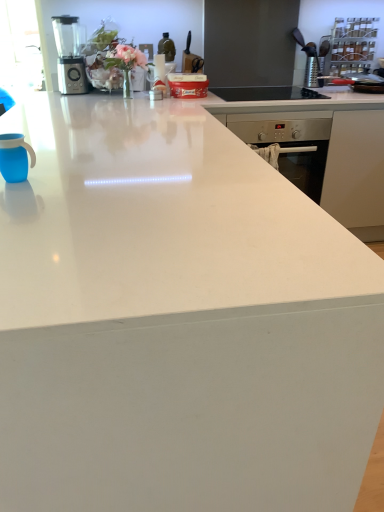
What are the coordinates of `metallic silver blender at upper left` in the screenshot? It's located at (70, 54).

Identify the location of black glass gas stove at upper center. (265, 93).

The width and height of the screenshot is (384, 512). Find the location of `metallic silver blender at upper left`. metallic silver blender at upper left is located at coordinates (70, 54).

From the picture: Would you say black glass gas stove at upper center is inside or outside blue matte mug at left?

black glass gas stove at upper center exists outside the volume of blue matte mug at left.

Consider the image. Considering the sizes of objects black glass gas stove at upper center and blue matte mug at left in the image provided, who is bigger, black glass gas stove at upper center or blue matte mug at left?

black glass gas stove at upper center is bigger.

Based on the photo, is black glass gas stove at upper center in front of or behind blue matte mug at left in the image?

black glass gas stove at upper center is positioned farther from the viewer than blue matte mug at left.

Does black glass gas stove at upper center appear on the left side of blue matte mug at left?

In fact, black glass gas stove at upper center is to the right of blue matte mug at left.

Which of these two, blue matte mug at left or black glass gas stove at upper center, is bigger?

With larger size is black glass gas stove at upper center.

Is there a large distance between blue matte mug at left and black glass gas stove at upper center?

Absolutely, blue matte mug at left is distant from black glass gas stove at upper center.

Find the location of a particular element. The height and width of the screenshot is (512, 384). mug on the left of black glass gas stove at upper center is located at coordinates (15, 157).

Between blue matte mug at left and black glass gas stove at upper center, which one appears on the left side from the viewer's perspective?

blue matte mug at left is more to the left.

Is metallic silver blender at upper left far away from blue matte mug at left?

Absolutely, metallic silver blender at upper left is distant from blue matte mug at left.

From the image's perspective, between metallic silver blender at upper left and blue matte mug at left, who is located below?

From the image's view, blue matte mug at left is below.

Who is smaller, metallic silver blender at upper left or blue matte mug at left?

With smaller size is blue matte mug at left.

From a real-world perspective, does metallic silver blender at upper left stand above blue matte mug at left?

Correct, in the physical world, metallic silver blender at upper left is higher than blue matte mug at left.

From a real-world perspective, between blue matte mug at left and metallic silver blender at upper left, who is vertically higher?

metallic silver blender at upper left.

Can you confirm if blue matte mug at left is taller than metallic silver blender at upper left?

Incorrect, the height of blue matte mug at left is not larger of that of metallic silver blender at upper left.

Consider the image. Which object is wider, blue matte mug at left or metallic silver blender at upper left?

With larger width is metallic silver blender at upper left.

Can you tell me how much blue matte mug at left and metallic silver blender at upper left differ in facing direction?

The angular difference between blue matte mug at left and metallic silver blender at upper left is 103 degrees.

Choose the correct answer: Is metallic silver blender at upper left inside black glass gas stove at upper center or outside it?

metallic silver blender at upper left lies outside black glass gas stove at upper center.

In the scene shown: How many degrees apart are the facing directions of metallic silver blender at upper left and black glass gas stove at upper center?

The facing directions of metallic silver blender at upper left and black glass gas stove at upper center are 12.3 degrees apart.

Considering their positions, is metallic silver blender at upper left located in front of or behind black glass gas stove at upper center?

metallic silver blender at upper left is positioned farther from the viewer than black glass gas stove at upper center.

From a real-world perspective, is metallic silver blender at upper left physically below black glass gas stove at upper center?

No, from a real-world perspective, metallic silver blender at upper left is not beneath black glass gas stove at upper center.

Is black glass gas stove at upper center taller or shorter than metallic silver blender at upper left?

black glass gas stove at upper center is shorter than metallic silver blender at upper left.

From the image's perspective, is black glass gas stove at upper center on top of metallic silver blender at upper left?

No, from the image's perspective, black glass gas stove at upper center is not above metallic silver blender at upper left.

Looking at the image, does black glass gas stove at upper center seem bigger or smaller compared to metallic silver blender at upper left?

Clearly, black glass gas stove at upper center is larger in size than metallic silver blender at upper left.

Do you think black glass gas stove at upper center is within metallic silver blender at upper left, or outside of it?

black glass gas stove at upper center exists outside the volume of metallic silver blender at upper left.

In order to click on gas stove lying above the blue matte mug at left (from the image's perspective) in this screenshot , I will do `click(265, 93)`.

Identify the location of mug located above the black glass gas stove at upper center (from a real-world perspective). (15, 157).

Considering their positions, is metallic silver blender at upper left positioned closer to blue matte mug at left than black glass gas stove at upper center?

Among the two, black glass gas stove at upper center is located nearer to blue matte mug at left.

Based on their spatial positions, is black glass gas stove at upper center or metallic silver blender at upper left further from blue matte mug at left?

metallic silver blender at upper left is further to blue matte mug at left.

Looking at the image, which one is located further to black glass gas stove at upper center, blue matte mug at left or metallic silver blender at upper left?

Among the two, blue matte mug at left is located further to black glass gas stove at upper center.

From the image, which object appears to be farther from black glass gas stove at upper center, metallic silver blender at upper left or blue matte mug at left?

The object further to black glass gas stove at upper center is blue matte mug at left.

From the picture: Looking at the image, which one is located closer to metallic silver blender at upper left, black glass gas stove at upper center or blue matte mug at left?

A: black glass gas stove at upper center is positioned closer to the anchor metallic silver blender at upper left.

Considering their positions, is blue matte mug at left positioned closer to metallic silver blender at upper left than black glass gas stove at upper center?

black glass gas stove at upper center is closer to metallic silver blender at upper left.

I want to click on gas stove positioned between blue matte mug at left and metallic silver blender at upper left from near to far, so click(x=265, y=93).